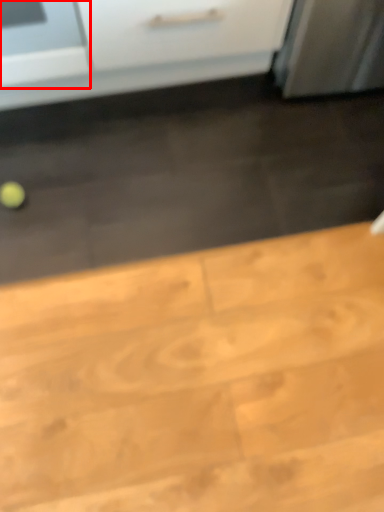
Question: From the image's perspective, what is the correct spatial relationship of appliance (annotated by the red box) in relation to table?

Choices:
 (A) below
 (B) above

Answer: (B)